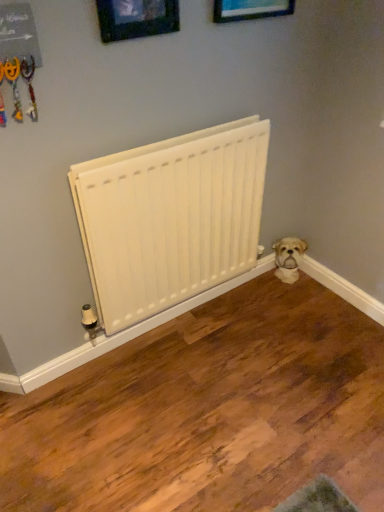
I want to click on vacant position to the left of white fluffy dog at lower right, so click(x=265, y=284).